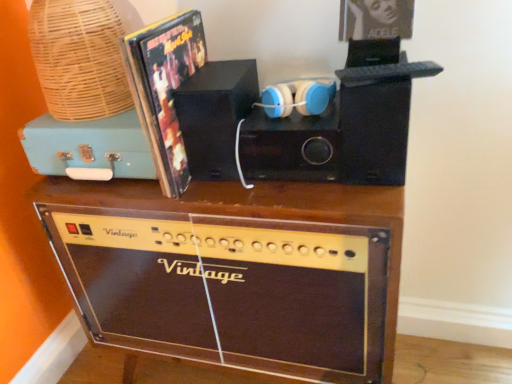
Question: Should I look upward or downward to see shiny plastic album cover at upper left?

Choices:
 (A) up
 (B) down

Answer: (A)

Question: From the image's perspective, would you say teal matte suitcase at upper left is shown under blue matte headphones at center?

Choices:
 (A) no
 (B) yes

Answer: (B)

Question: Is teal matte suitcase at upper left shorter than blue matte headphones at center?

Choices:
 (A) yes
 (B) no

Answer: (B)

Question: From the image's perspective, would you say teal matte suitcase at upper left is positioned over blue matte headphones at center?

Choices:
 (A) no
 (B) yes

Answer: (A)

Question: Is teal matte suitcase at upper left wider than blue matte headphones at center?

Choices:
 (A) no
 (B) yes

Answer: (B)

Question: Is teal matte suitcase at upper left placed right next to blue matte headphones at center?

Choices:
 (A) yes
 (B) no

Answer: (B)

Question: Is teal matte suitcase at upper left surrounding blue matte headphones at center?

Choices:
 (A) no
 (B) yes

Answer: (A)

Question: Considering the relative positions of black matte speaker at center, the 2th speaker positioned from the left, and black matte speaker at center, the 2th speaker viewed from the right, in the image provided, is black matte speaker at center, the 2th speaker positioned from the left, to the left of black matte speaker at center, the 2th speaker viewed from the right, from the viewer's perspective?

Choices:
 (A) no
 (B) yes

Answer: (A)

Question: Is black matte speaker at center, the first speaker when ordered from right to left, taller than black matte speaker at center, the 2th speaker viewed from the right?

Choices:
 (A) yes
 (B) no

Answer: (B)

Question: Is black matte speaker at center, the first speaker when ordered from right to left, not near black matte speaker at center, which is the first speaker in left-to-right order?

Choices:
 (A) no
 (B) yes

Answer: (A)

Question: From the image's perspective, would you say black matte speaker at center, the 2th speaker positioned from the left, is positioned over black matte speaker at center, which is the first speaker in left-to-right order?

Choices:
 (A) yes
 (B) no

Answer: (B)

Question: Can you confirm if black matte speaker at center, the 2th speaker positioned from the left, is thinner than black matte speaker at center, which is the first speaker in left-to-right order?

Choices:
 (A) yes
 (B) no

Answer: (A)

Question: Is black matte speaker at center, the 2th speaker positioned from the left, aimed at black matte speaker at center, the 2th speaker viewed from the right?

Choices:
 (A) no
 (B) yes

Answer: (A)

Question: Is the surface of black matte speaker at center, the first speaker when ordered from right to left, in direct contact with brown wood amplifier at lower center?

Choices:
 (A) yes
 (B) no

Answer: (B)